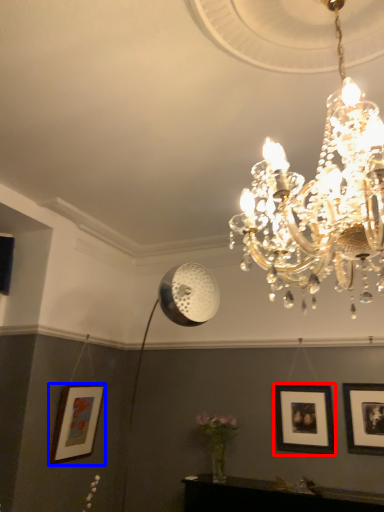
Question: Which point is further to the camera, picture frame (highlighted by a red box) or picture frame (highlighted by a blue box)?

Choices:
 (A) picture frame
 (B) picture frame

Answer: (B)